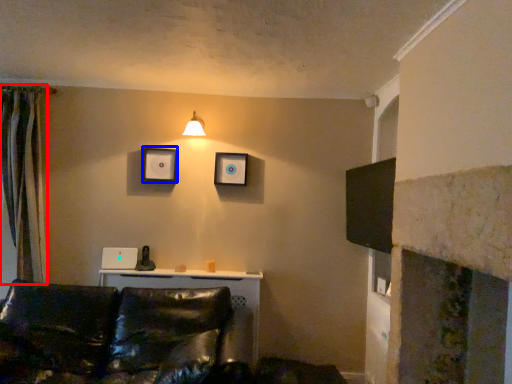
Question: Which object is further to the camera taking this photo, curtain (highlighted by a red box) or picture frame (highlighted by a blue box)?

Choices:
 (A) curtain
 (B) picture frame

Answer: (B)